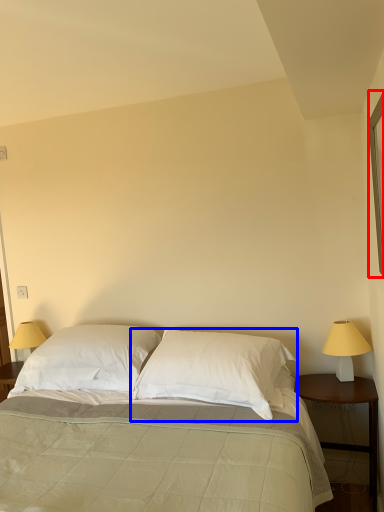
Question: Which point is further to the camera, window (highlighted by a red box) or pillow (highlighted by a blue box)?

Choices:
 (A) window
 (B) pillow

Answer: (B)